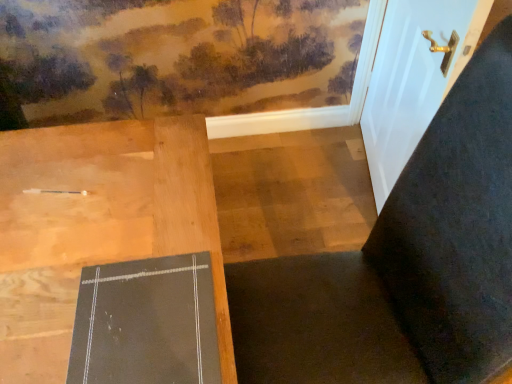
Question: Is dark fabric chair at center in front of or behind white glossy door at upper right in the image?

Choices:
 (A) behind
 (B) front

Answer: (B)

Question: Is dark fabric chair at center inside the boundaries of white glossy door at upper right, or outside?

Choices:
 (A) inside
 (B) outside

Answer: (B)

Question: Which object is positioned farthest from the dark fabric chair at center?

Choices:
 (A) matte black bulletin board at center
 (B) white glossy door at upper right

Answer: (B)

Question: Estimate the real-world distances between objects in this image. Which object is farther from the dark fabric chair at center?

Choices:
 (A) white glossy door at upper right
 (B) matte black bulletin board at center

Answer: (A)